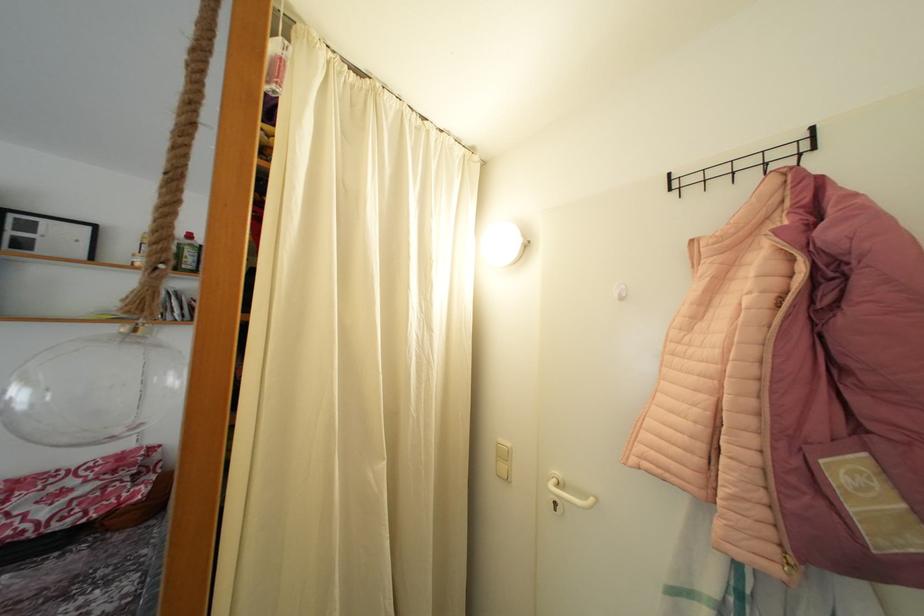
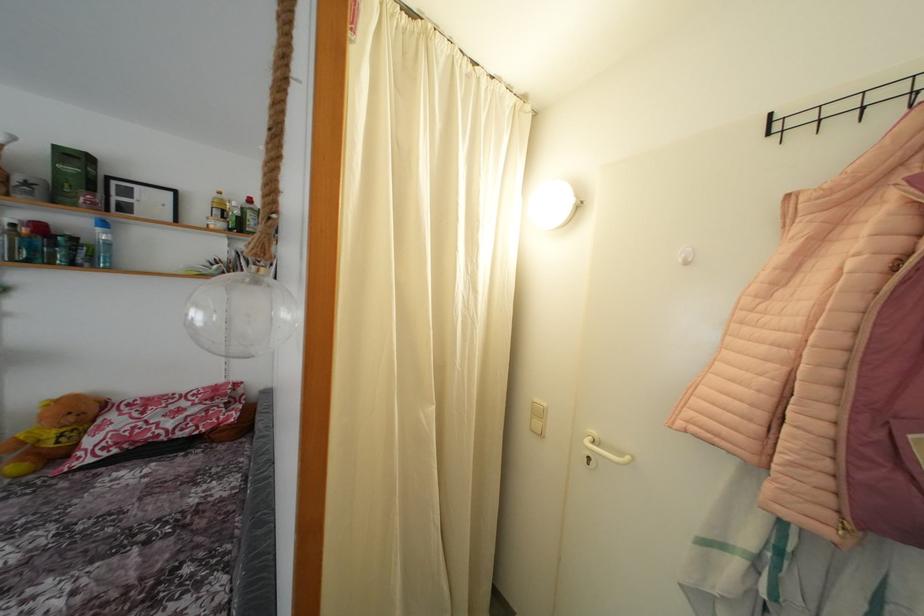
Question: I am providing you with two images of the same scene from different viewpoints. Please identify which objects are invisible in image2.

Choices:
 (A) white wall hook
 (B) blue water bottle
 (C) white light switch
 (D) none of these

Answer: (D)